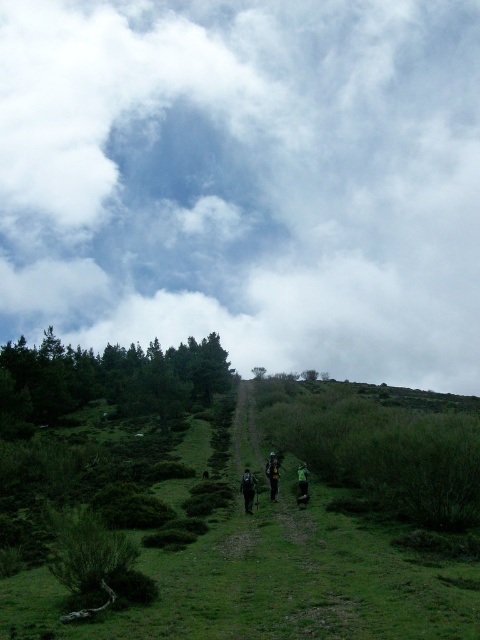
You are a hiker looking at the path ahead. You notice the cloudy sky at upper center and the camouflage fabric backpack at center. Which object is located to the right of the other?

The cloudy sky at upper center is positioned on the right side of camouflage fabric backpack at center.

Looking at this image, you are a hiker trying to place your camouflage fabric backpack at center on the green grassy at center. Based on the scene, can you tell if the backpack will be visible once placed there?

The green grassy at center is in front of the camouflage fabric backpack at center, so placing the camouflage fabric backpack at center on the green grassy at center would make it partially hidden behind the grass, reducing its visibility.